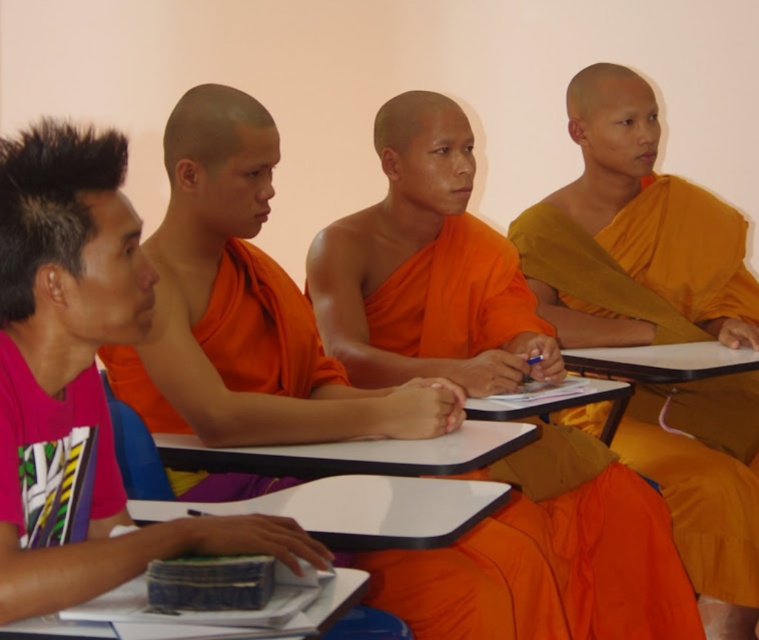
Question: Is orange silk robe at center positioned before pink fabric shirt at left?

Choices:
 (A) yes
 (B) no

Answer: (B)

Question: Is orange silk robe at center to the right of pink fabric shirt at left from the viewer's perspective?

Choices:
 (A) yes
 (B) no

Answer: (A)

Question: Which object is positioned closest to the orange cloth at center?

Choices:
 (A) orange silk robe at center
 (B) orange silk monk robe at center

Answer: (B)

Question: Observing the image, what is the correct spatial positioning of orange cloth at center in reference to pink fabric shirt at left?

Choices:
 (A) left
 (B) right

Answer: (B)

Question: Among these objects, which one is nearest to the camera?

Choices:
 (A) orange cloth at center
 (B) pink fabric shirt at left
 (C) orange silk robe at center
 (D) orange silk monk robe at center

Answer: (B)

Question: Among these points, which one is nearest to the camera?

Choices:
 (A) (8, 520)
 (B) (290, 417)
 (C) (701, 460)
 (D) (572, 541)

Answer: (A)